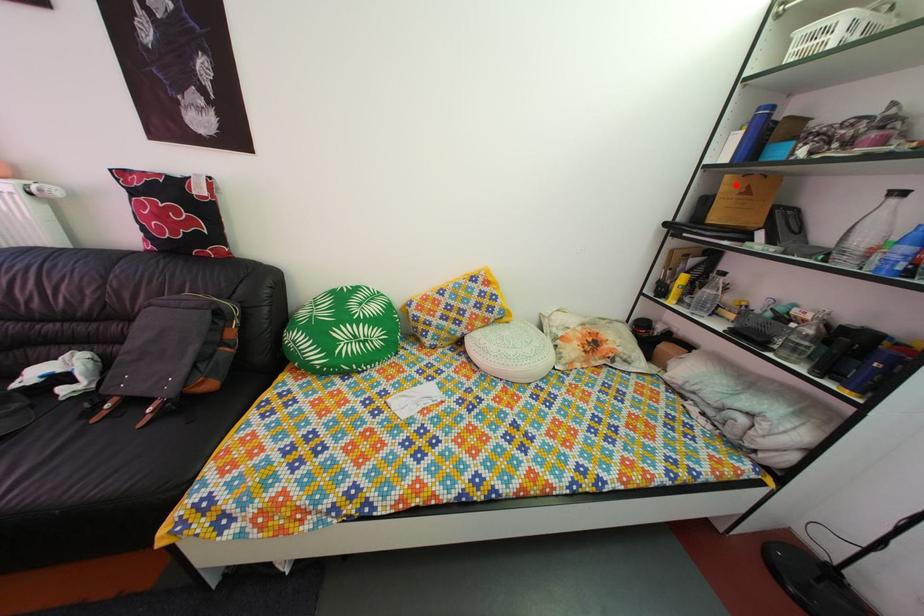
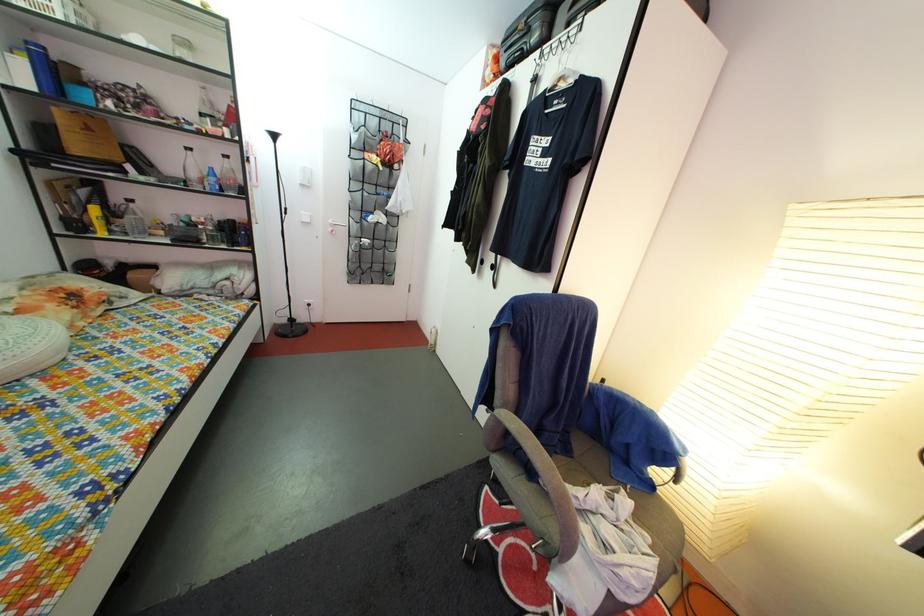
Find the pixel in the second image that matches the highlighted location in the first image.

(64, 118)